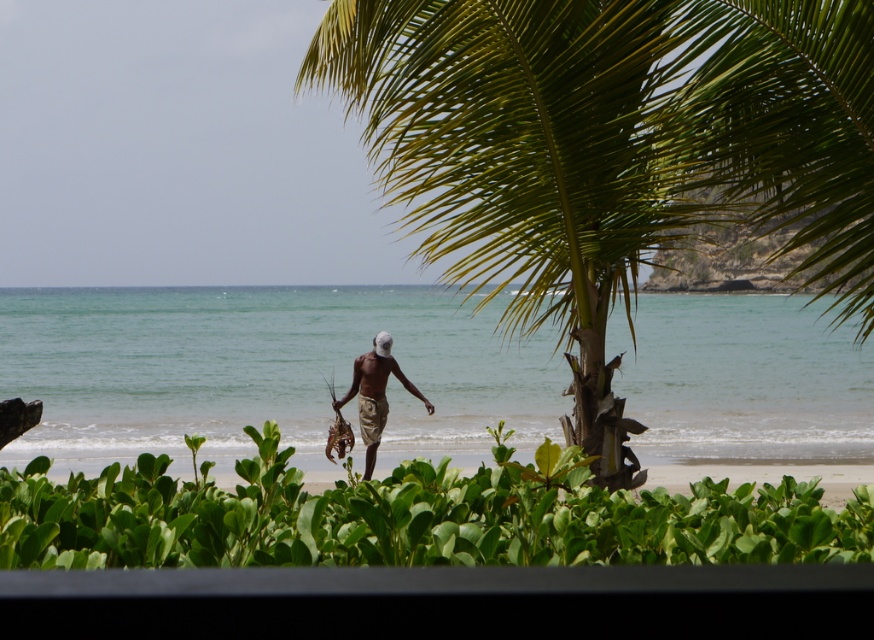
Question: Can you confirm if green leafy shrub at lower center is positioned below brown fabric man at center?

Choices:
 (A) no
 (B) yes

Answer: (A)

Question: Which point is farther to the camera?

Choices:
 (A) (862, 260)
 (B) (362, 378)
 (C) (866, 540)

Answer: (B)

Question: Which point appears closest to the camera in this image?

Choices:
 (A) (671, 13)
 (B) (668, 525)
 (C) (335, 406)

Answer: (B)

Question: From the image, what is the correct spatial relationship of green leafy palm tree at center in relation to green leafy shrub at lower center?

Choices:
 (A) above
 (B) below

Answer: (A)

Question: Is green leafy shrub at lower center positioned at the back of brown fabric man at center?

Choices:
 (A) yes
 (B) no

Answer: (B)

Question: Which of the following is the closest to the observer?

Choices:
 (A) green leafy palm tree at center
 (B) green leafy shrub at lower center

Answer: (B)